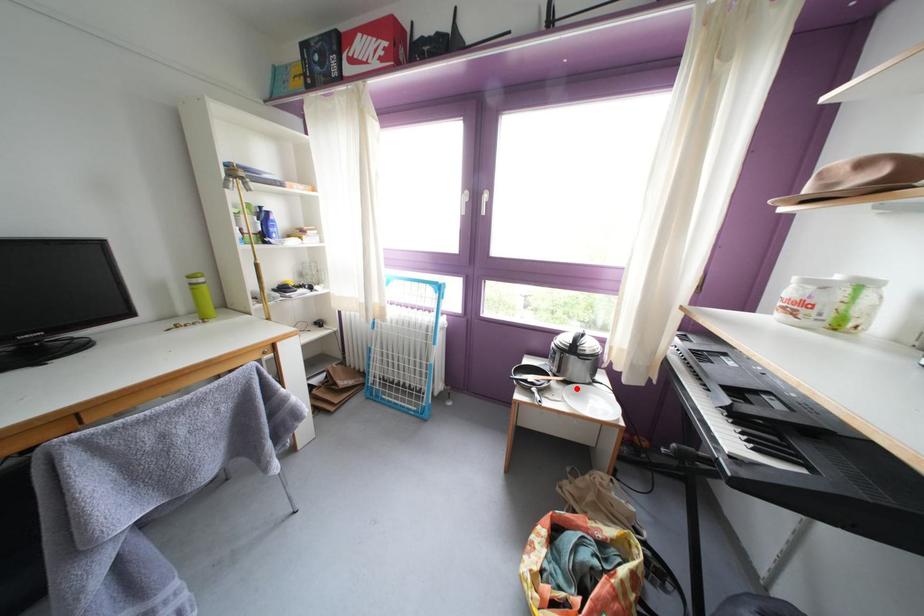
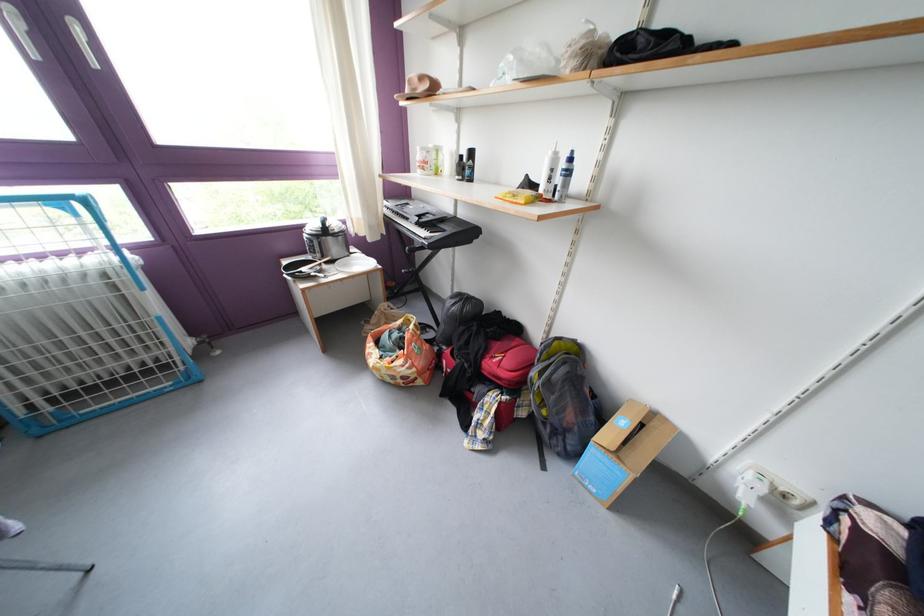
Find the pixel in the second image that matches the highlighted location in the first image.

(344, 267)